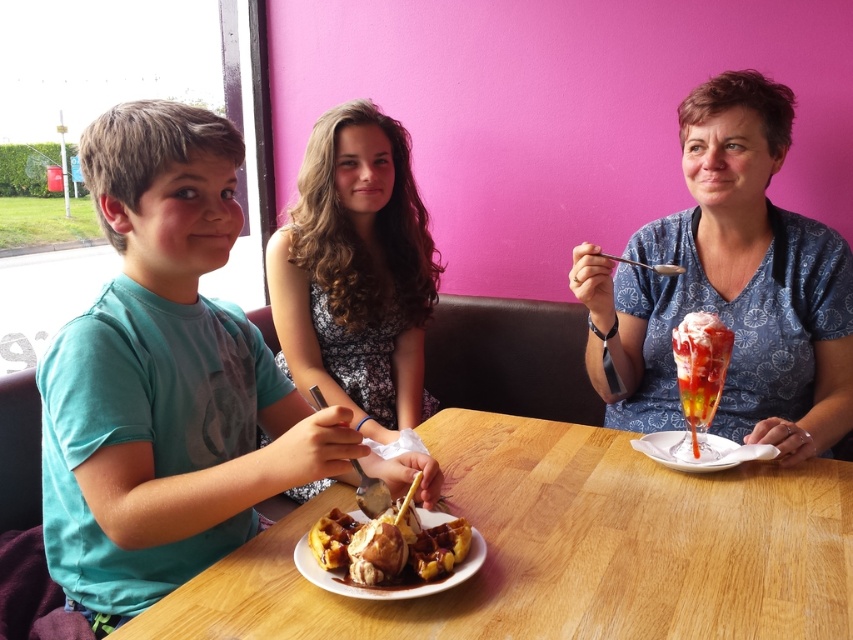
What do you see at coordinates (730, 285) in the screenshot?
I see `blue printed dress at center` at bounding box center [730, 285].

Consider the image. Which is above, blue printed dress at center or translucent glass parfait at right?

blue printed dress at center is above.

The image size is (853, 640). I want to click on blue printed dress at center, so click(730, 285).

Is translucent glass parfait at right positioned at the back of white glossy plate at lower right?

That is True.

Does translucent glass parfait at right have a larger size compared to white glossy plate at lower right?

No, translucent glass parfait at right is not bigger than white glossy plate at lower right.

Find the location of a particular element. This screenshot has height=640, width=853. translucent glass parfait at right is located at coordinates (699, 380).

Image resolution: width=853 pixels, height=640 pixels. Describe the element at coordinates (170, 381) in the screenshot. I see `teal matte shirt at left` at that location.

Locate an element on the screen. This screenshot has width=853, height=640. teal matte shirt at left is located at coordinates (170, 381).